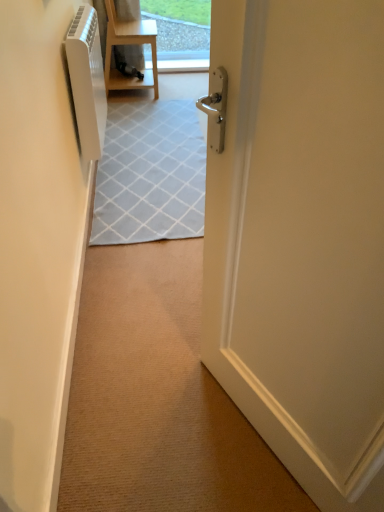
Question: Can you confirm if white glossy radiator at left is bigger than white plastic air conditioner at left?

Choices:
 (A) no
 (B) yes

Answer: (A)

Question: Is white glossy radiator at left at the left side of white plastic air conditioner at left?

Choices:
 (A) yes
 (B) no

Answer: (A)

Question: Can we say white glossy radiator at left lies outside white plastic air conditioner at left?

Choices:
 (A) yes
 (B) no

Answer: (A)

Question: From a real-world perspective, is white glossy radiator at left located beneath white plastic air conditioner at left?

Choices:
 (A) yes
 (B) no

Answer: (A)

Question: Does white glossy radiator at left have a greater width compared to white plastic air conditioner at left?

Choices:
 (A) yes
 (B) no

Answer: (B)

Question: Is white glossy radiator at left closer to the viewer compared to white plastic air conditioner at left?

Choices:
 (A) yes
 (B) no

Answer: (A)

Question: Is there a large distance between light wood/matte chair at upper center and white plastic air conditioner at left?

Choices:
 (A) no
 (B) yes

Answer: (A)

Question: Can you confirm if light wood/matte chair at upper center is shorter than white plastic air conditioner at left?

Choices:
 (A) yes
 (B) no

Answer: (A)

Question: Can white plastic air conditioner at left be found inside light wood/matte chair at upper center?

Choices:
 (A) yes
 (B) no

Answer: (B)

Question: Is light wood/matte chair at upper center taller than white plastic air conditioner at left?

Choices:
 (A) no
 (B) yes

Answer: (A)

Question: Is light wood/matte chair at upper center wider than white plastic air conditioner at left?

Choices:
 (A) yes
 (B) no

Answer: (A)

Question: Can you confirm if light wood/matte chair at upper center is thinner than white plastic air conditioner at left?

Choices:
 (A) yes
 (B) no

Answer: (B)

Question: Considering the relative sizes of white glossy radiator at left and white glossy door at center in the image provided, is white glossy radiator at left wider than white glossy door at center?

Choices:
 (A) no
 (B) yes

Answer: (A)